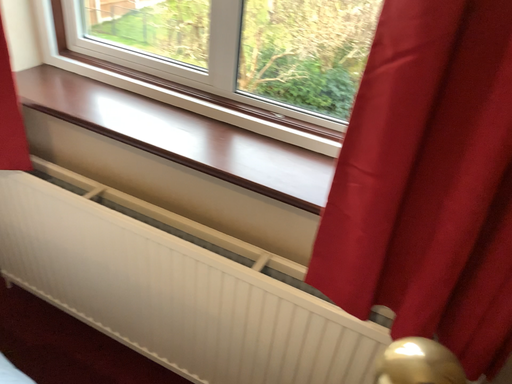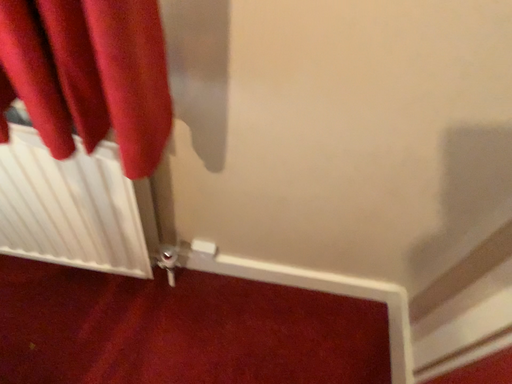
Question: How did the camera likely rotate when shooting the video?

Choices:
 (A) rotated left
 (B) rotated right

Answer: (B)